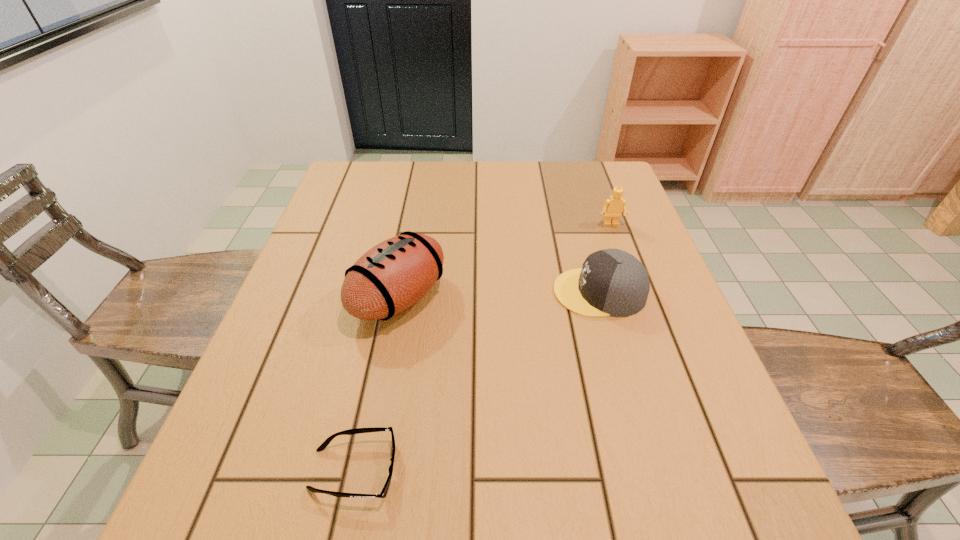
Identify the location of vacant area at the far left corner of the desktop. (348, 181).

Image resolution: width=960 pixels, height=540 pixels. I want to click on vacant position at the near left corner of the desktop, so click(283, 505).

Where is `vacant space at the far right corner of the desktop`? The width and height of the screenshot is (960, 540). vacant space at the far right corner of the desktop is located at coordinates (585, 161).

Identify the location of unoccupied position between the sunglasses and the tallest object. The height and width of the screenshot is (540, 960). (376, 384).

Where is `free space between the football (American) and the third tallest object`? The height and width of the screenshot is (540, 960). free space between the football (American) and the third tallest object is located at coordinates (499, 295).

Locate an element on the screen. This screenshot has width=960, height=540. vacant point located between the tallest object and the Lego is located at coordinates (505, 261).

Find the location of a particular element. The image size is (960, 540). free space between the cap and the sunglasses is located at coordinates (476, 381).

Locate an element on the screen. The image size is (960, 540). vacant space in between the Lego and the sunglasses is located at coordinates (483, 347).

Locate an element on the screen. This screenshot has height=540, width=960. vacant space in between the second tallest object and the tallest object is located at coordinates (505, 261).

I want to click on empty space between the nearest object and the football (American), so click(376, 384).